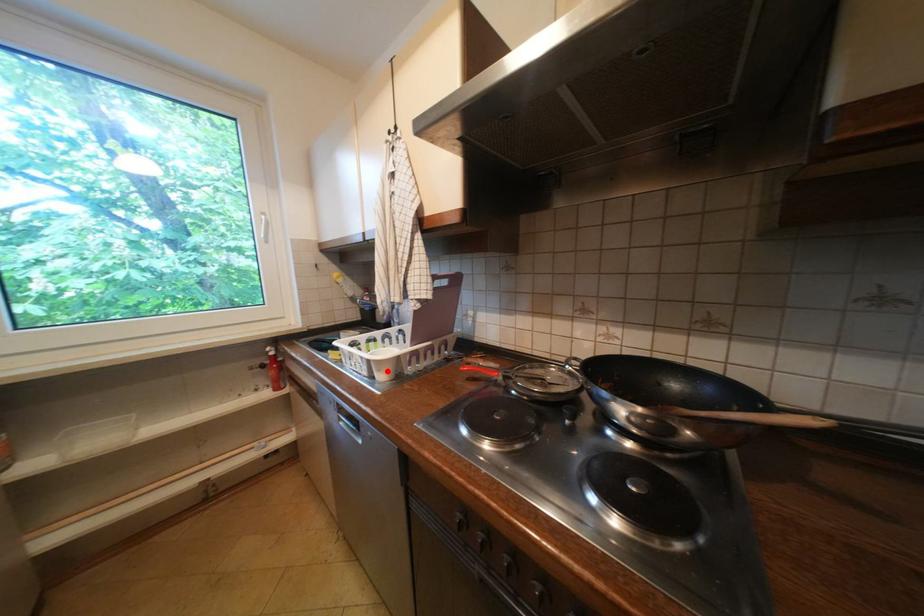
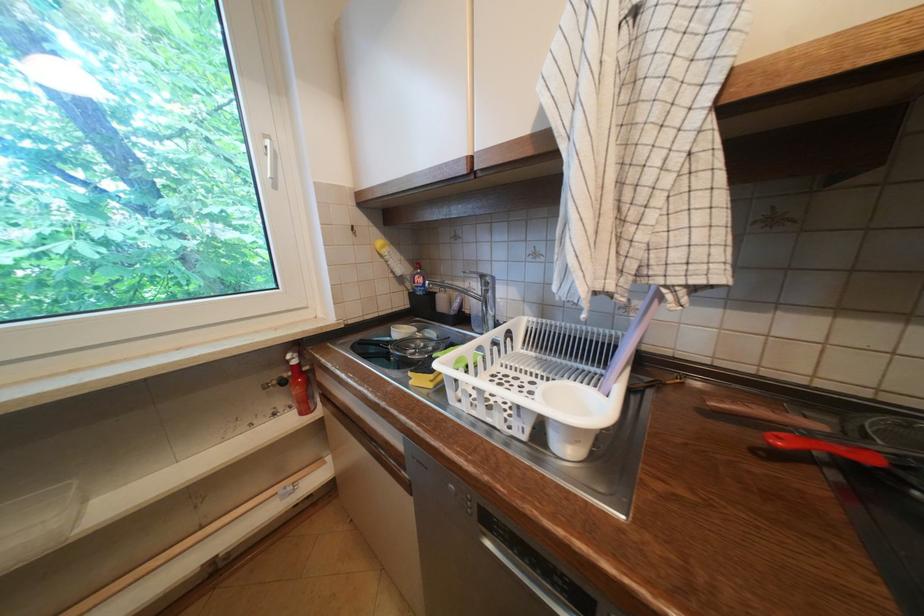
The point at the highlighted location is marked in the first image. Where is the corresponding point in the second image?

(586, 443)